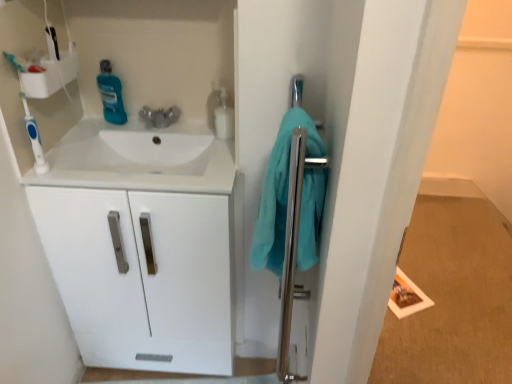
Question: Is white plastic shelf at upper left taller or shorter than polished chrome towel bar at right?

Choices:
 (A) tall
 (B) short

Answer: (B)

Question: From a real-world perspective, is white plastic shelf at upper left physically located above or below polished chrome towel bar at right?

Choices:
 (A) below
 (B) above

Answer: (B)

Question: Which object is positioned closest to the translucent plastic bottle at upper center, which is counted as the second cleaning product, starting from the left?

Choices:
 (A) blue plastic toothbrush at left
 (B) polished chrome towel bar at right
 (C) white glossy cabinet at left
 (D) teal glossy mouthwash at upper left, the second cleaning product from the right
 (E) teal fabric towel at right

Answer: (E)

Question: Which object is the closest to the teal fabric towel at right?

Choices:
 (A) translucent plastic bottle at upper center, which is counted as the second cleaning product, starting from the left
 (B) blue plastic toothbrush at left
 (C) white plastic shelf at upper left
 (D) teal glossy mouthwash at upper left, the second cleaning product from the right
 (E) polished chrome towel bar at right

Answer: (E)